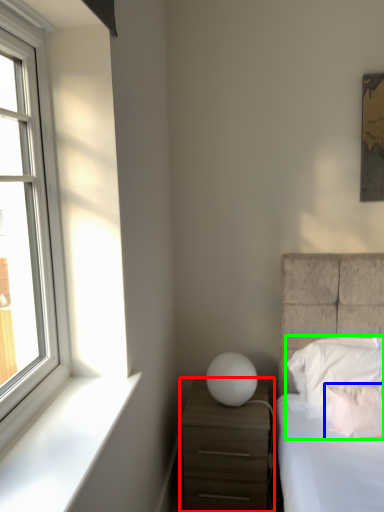
Question: Based on their relative distances, which object is farther from nightstand (highlighted by a red box)? Choose from pillow (highlighted by a blue box) and pillow (highlighted by a green box).

Choices:
 (A) pillow
 (B) pillow

Answer: (A)